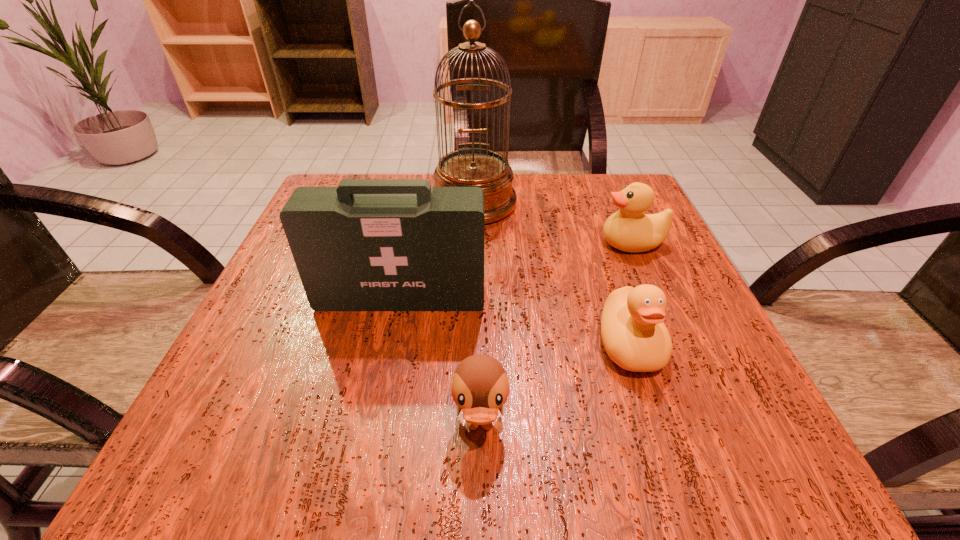
Find the location of a particular element. This screenshot has height=540, width=960. the farthest object is located at coordinates (471, 167).

Where is `the tallest object`? Image resolution: width=960 pixels, height=540 pixels. the tallest object is located at coordinates (471, 167).

Locate an element on the screen. This screenshot has height=540, width=960. the first-aid kit is located at coordinates (369, 244).

This screenshot has height=540, width=960. I want to click on the fourth shortest object, so click(x=369, y=244).

Where is `the second farthest object`? The height and width of the screenshot is (540, 960). the second farthest object is located at coordinates (629, 230).

Where is `the fourth farthest object`? The image size is (960, 540). the fourth farthest object is located at coordinates (633, 333).

At what (x,y) coordinates should I click in order to perform the action: click on the nearest object. Please return your answer as a coordinate pair (x, y). This screenshot has height=540, width=960. Looking at the image, I should click on (480, 386).

Identify the location of the leftmost duck. This screenshot has width=960, height=540. (480, 386).

The width and height of the screenshot is (960, 540). I want to click on blank space located 0.240m with an open door on the farthest object, so click(x=471, y=306).

Where is `free region located on the front-facing side of the second tallest object`? The height and width of the screenshot is (540, 960). free region located on the front-facing side of the second tallest object is located at coordinates (383, 385).